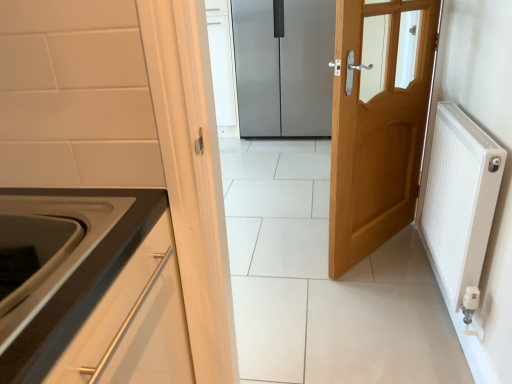
Identify the location of vacant space in white ribbed radiator at right (from a real-world perspective). (439, 302).